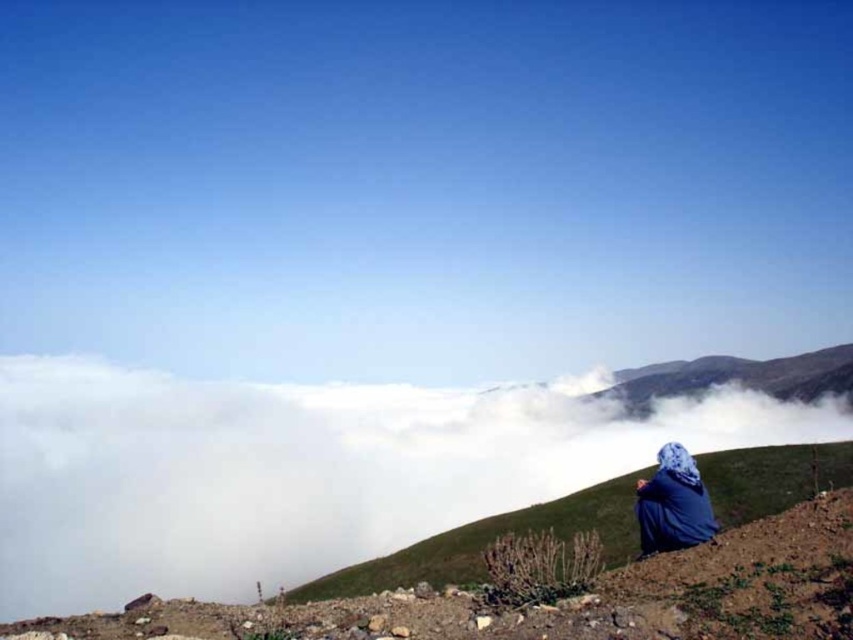
Question: Which point is farther to the camera?

Choices:
 (A) white fluffy cloud at upper center
 (B) blue fabric headscarf at lower right

Answer: (B)

Question: Is white fluffy cloud at upper center closer to the viewer compared to blue fabric headscarf at lower right?

Choices:
 (A) yes
 (B) no

Answer: (A)

Question: Which point is closer to the camera taking this photo?

Choices:
 (A) (138, 380)
 (B) (675, 497)

Answer: (B)

Question: Among these objects, which one is nearest to the camera?

Choices:
 (A) white fluffy cloud at upper center
 (B) blue fabric headscarf at lower right

Answer: (A)

Question: From the image, what is the correct spatial relationship of white fluffy cloud at upper center in relation to blue fabric headscarf at lower right?

Choices:
 (A) below
 (B) above

Answer: (A)

Question: Does white fluffy cloud at upper center have a greater width compared to blue fabric headscarf at lower right?

Choices:
 (A) yes
 (B) no

Answer: (A)